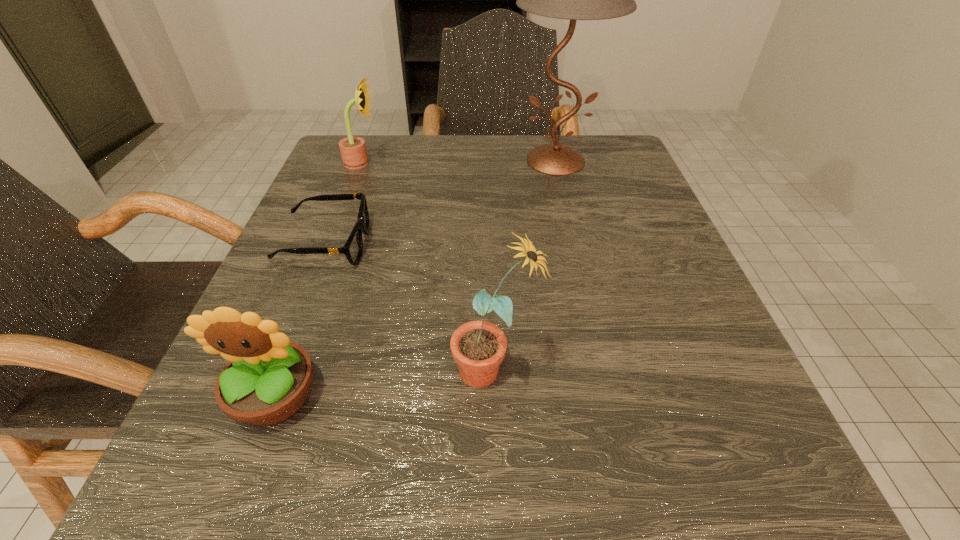
This screenshot has width=960, height=540. Identify the location of the tallest object. click(574, 0).

Locate an element on the screen. the tallest sunflower is located at coordinates (478, 347).

The height and width of the screenshot is (540, 960). What are the coordinates of `the second tallest object` in the screenshot? It's located at (478, 347).

This screenshot has height=540, width=960. What are the coordinates of `the farthest sunflower` in the screenshot? It's located at (353, 151).

At what (x,y) coordinates should I click in order to perform the action: click on the third farthest object. Please return your answer as a coordinate pair (x, y). The width and height of the screenshot is (960, 540). Looking at the image, I should click on (353, 248).

Where is `the shortest object`? The height and width of the screenshot is (540, 960). the shortest object is located at coordinates (353, 248).

At what (x,y) coordinates should I click in order to perform the action: click on vacant space located 0.100m on the front-facing side of the tallest object. Please return your answer as a coordinate pair (x, y). Image resolution: width=960 pixels, height=540 pixels. Looking at the image, I should click on (569, 215).

Where is `free spot located 0.110m on the flower of the tallest sunflower`? This screenshot has height=540, width=960. free spot located 0.110m on the flower of the tallest sunflower is located at coordinates (369, 370).

Where is `free space located 0.290m on the flower of the tallest sunflower`? Image resolution: width=960 pixels, height=540 pixels. free space located 0.290m on the flower of the tallest sunflower is located at coordinates (231, 370).

Image resolution: width=960 pixels, height=540 pixels. Find the location of `free space located 0.290m on the flower of the tallest sunflower`. free space located 0.290m on the flower of the tallest sunflower is located at coordinates pos(231,370).